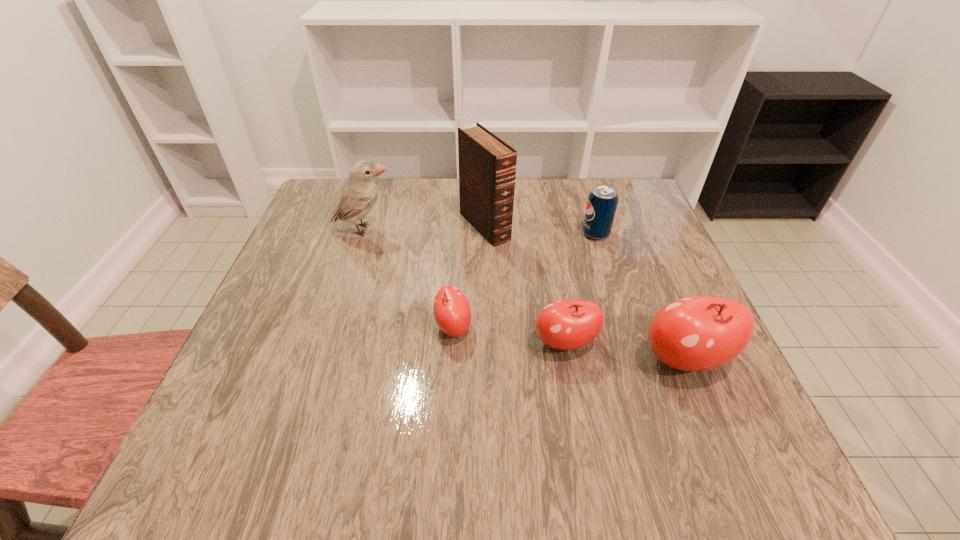
The image size is (960, 540). What are the coordinates of `free point located on the left of the rightmost apple` in the screenshot? It's located at (484, 360).

The image size is (960, 540). What are the coordinates of `free space located 0.300m on the front of the Bible` in the screenshot? It's located at (487, 345).

Where is `vacant space located at the face of the bird`? vacant space located at the face of the bird is located at coordinates (507, 230).

What are the coordinates of `vacant space located on the front of the soda can` in the screenshot? It's located at (642, 381).

Where is `Bible at the far edge`? This screenshot has width=960, height=540. Bible at the far edge is located at coordinates (487, 165).

Identify the location of bird present at the far edge. The image size is (960, 540). [x=359, y=194].

The width and height of the screenshot is (960, 540). I want to click on soda can located in the far edge section of the desktop, so 602,202.

The height and width of the screenshot is (540, 960). Identify the location of object that is at the near edge. (696, 333).

I want to click on object that is positioned at the left edge, so click(359, 194).

Identify the location of apple present at the right edge. The height and width of the screenshot is (540, 960). (696, 333).